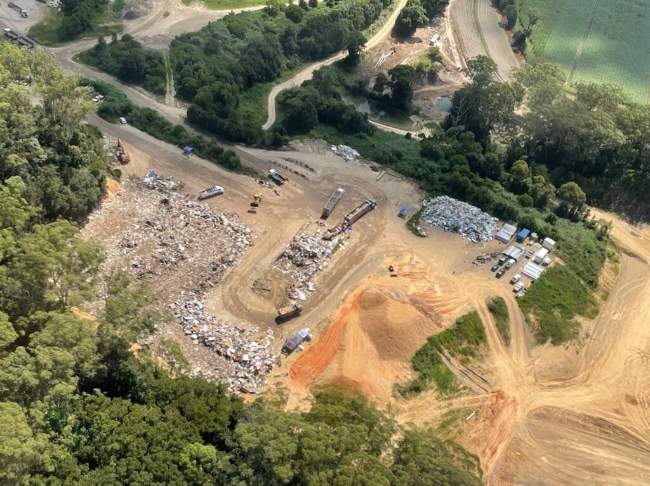
This screenshot has height=486, width=650. I want to click on storage containers, so click(515, 253), click(509, 230), click(530, 266).